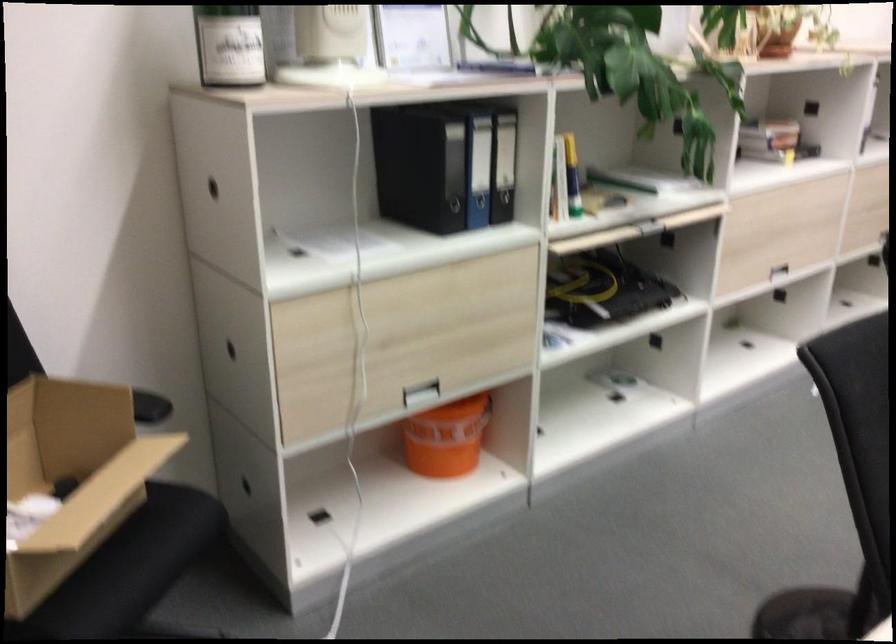
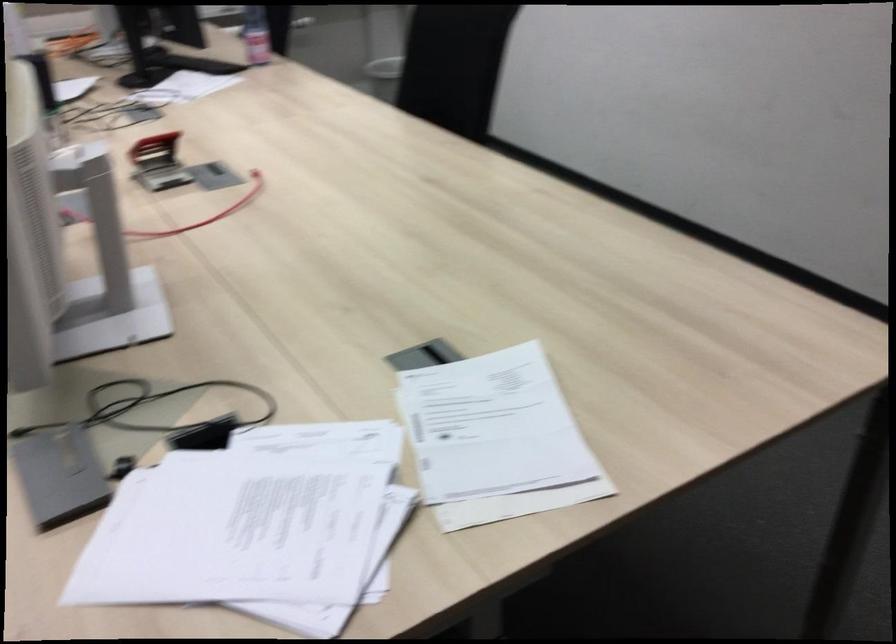
Based on the continuous images, in which direction is the camera rotating?

The camera rotated toward right-down.